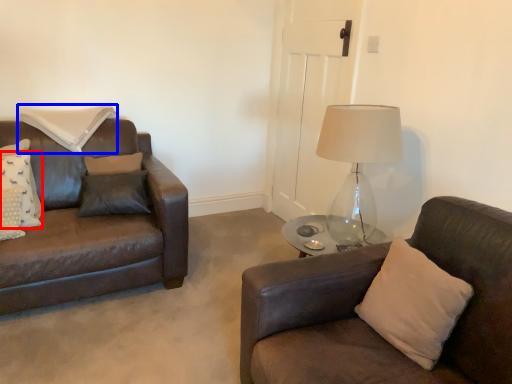
Question: Which of the following is the farthest to the observer, pillow (highlighted by a red box) or pillow (highlighted by a blue box)?

Choices:
 (A) pillow
 (B) pillow

Answer: (B)